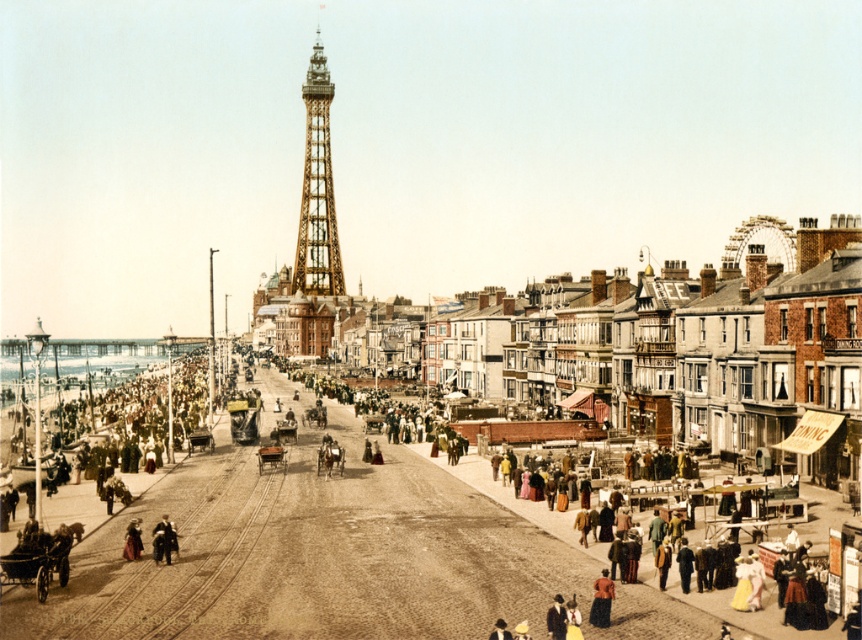
Is golden metallic tower at center above brown fabric dress at lower right?

Indeed, golden metallic tower at center is positioned over brown fabric dress at lower right.

Can you confirm if golden metallic tower at center is positioned below brown fabric dress at lower right?

No, golden metallic tower at center is not below brown fabric dress at lower right.

Is point (311, 180) behind point (604, 573)?

That is True.

Where is `golden metallic tower at center`? golden metallic tower at center is located at coordinates (317, 189).

Is golden metallic tower at center to the left of matte red dress at lower left from the viewer's perspective?

Correct, you'll find golden metallic tower at center to the left of matte red dress at lower left.

Who is positioned more to the right, golden metallic tower at center or matte red dress at lower left?

matte red dress at lower left

Which is in front, point (315, 250) or point (132, 529)?

Point (132, 529) is more forward.

I want to click on golden metallic tower at center, so click(x=317, y=189).

Who is higher up, brown fabric dress at lower right or matte red dress at lower left?

Positioned higher is matte red dress at lower left.

Does brown fabric dress at lower right have a larger size compared to matte red dress at lower left?

Correct, brown fabric dress at lower right is larger in size than matte red dress at lower left.

The height and width of the screenshot is (640, 862). I want to click on brown fabric dress at lower right, so click(x=601, y=600).

In order to click on brown fabric dress at lower right in this screenshot , I will do `click(601, 600)`.